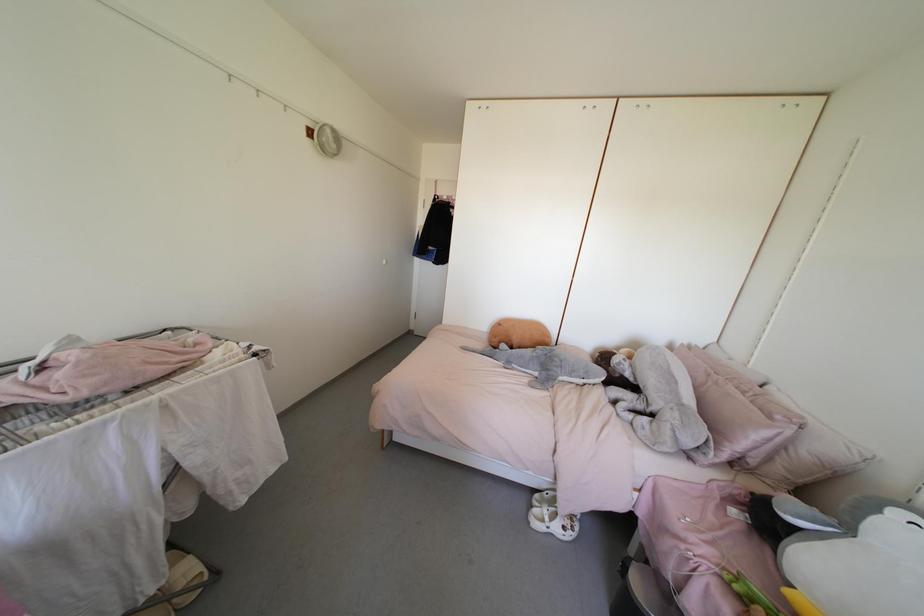
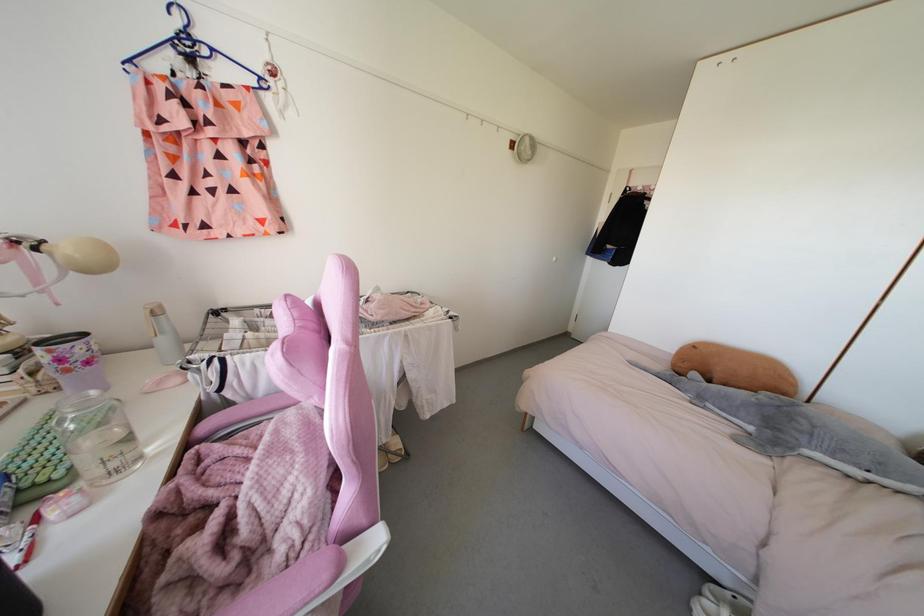
Find the pixel in the second image that matches [494,347] in the first image.

(679, 374)